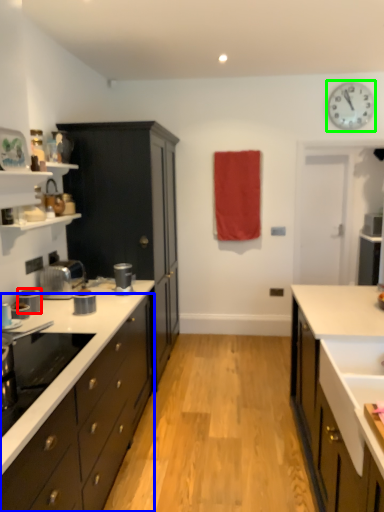
Question: Which object is positioned closest to kitchen appliance (highlighted by a red box)? Select from cabinetry (highlighted by a blue box) and clock (highlighted by a green box).

Choices:
 (A) cabinetry
 (B) clock

Answer: (A)